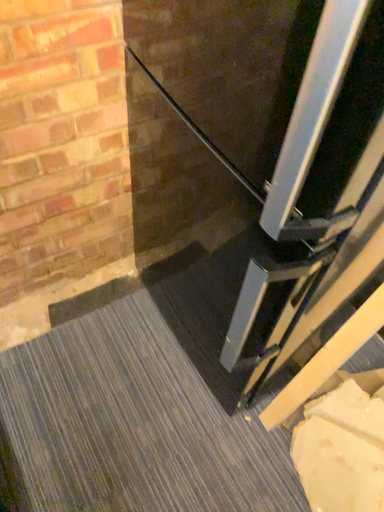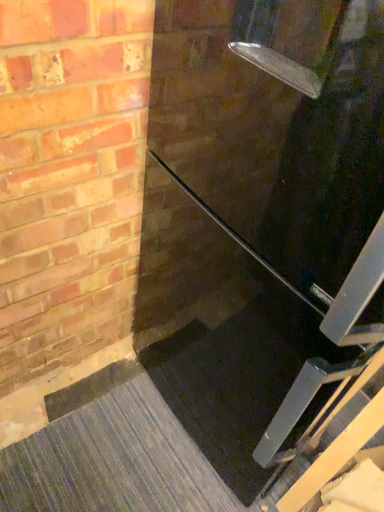
Question: How did the camera likely rotate when shooting the video?

Choices:
 (A) rotated upward
 (B) rotated downward

Answer: (A)